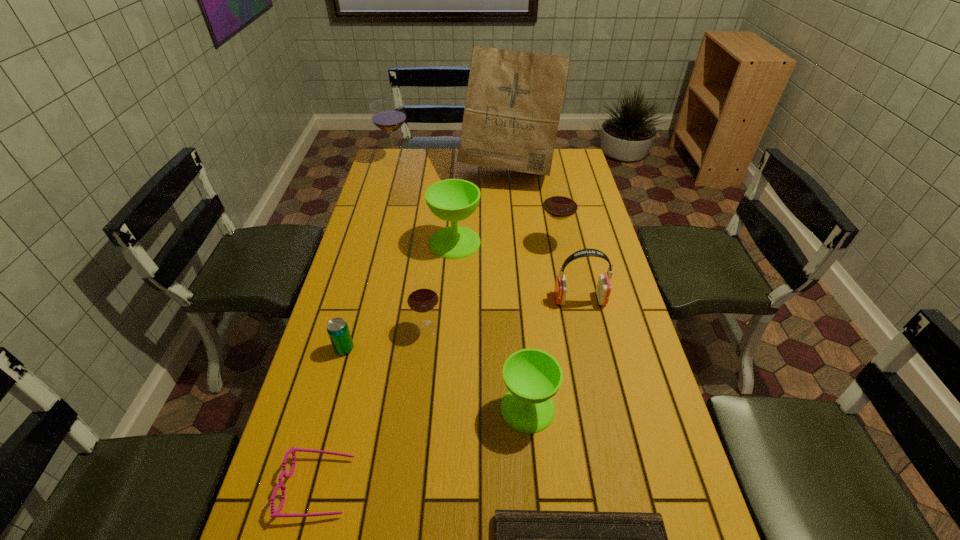
Identify the location of vacant area that lies between the pink earphone and the smallest red wineglass. The width and height of the screenshot is (960, 540). (503, 314).

Find the location of a particular element. The height and width of the screenshot is (540, 960). object that can be found as the sixth closest to the spectacles is located at coordinates (603, 289).

In order to click on object that stands as the second closest to the shortest object in this screenshot , I will do `click(274, 513)`.

Identify the location of wineglass object that ranks as the second closest to the second nearest wineglass. The width and height of the screenshot is (960, 540). (453, 200).

At what (x,y) coordinates should I click in order to perform the action: click on the fourth closest wineglass to the smallest red wineglass. Please return your answer as a coordinate pair (x, y). Looking at the image, I should click on (388, 115).

Find the location of `the third closest red wineglass to the smaller green wineglass`. the third closest red wineglass to the smaller green wineglass is located at coordinates (388, 115).

Identify which red wineglass is the third closest to the shortest object. Please provide its 2D coordinates. Your answer should be formatted as a tuple, i.e. [(x, y)], where the tuple contains the x and y coordinates of a point satisfying the conditions above.

[(388, 115)]

This screenshot has height=540, width=960. I want to click on blank space that satisfies the following two spatial constraints: 1. on the front side of the leftmost wineglass; 2. on the right side of the eighth farthest object, so click(x=327, y=408).